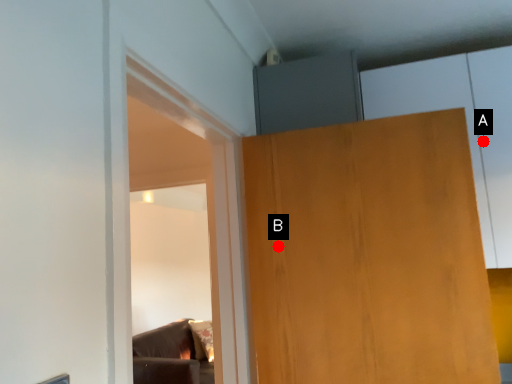
Question: Two points are circled on the image, labeled by A and B beside each circle. Among these points, which one is farthest from the camera?

Choices:
 (A) A is further
 (B) B is further

Answer: (A)